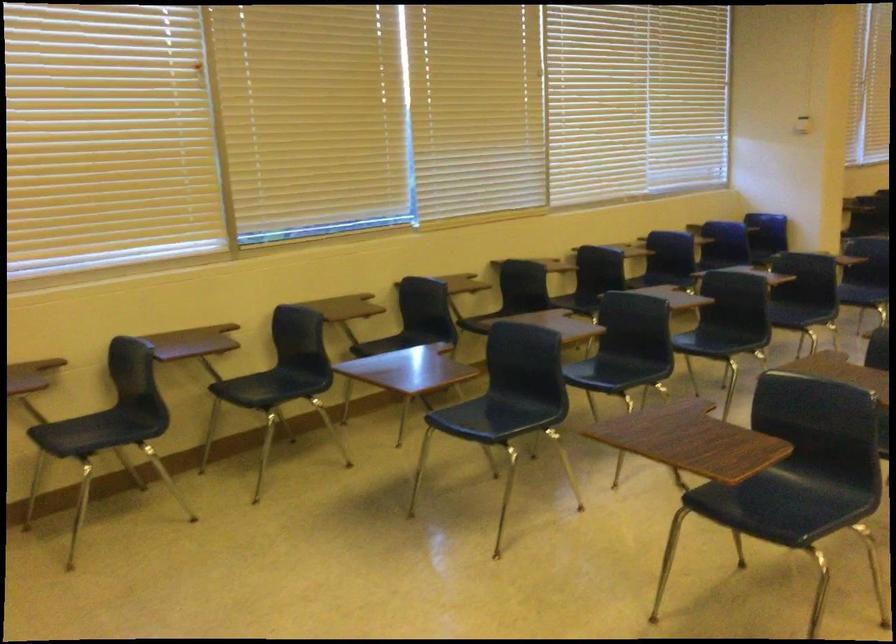
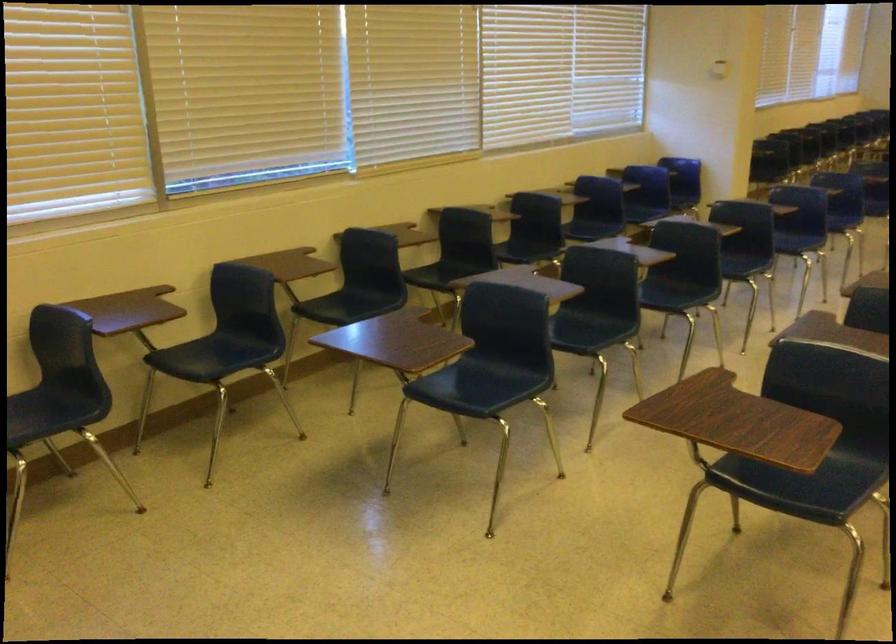
Locate, in the second image, the point that corresponds to the point at 412,345 in the first image.

(359, 303)